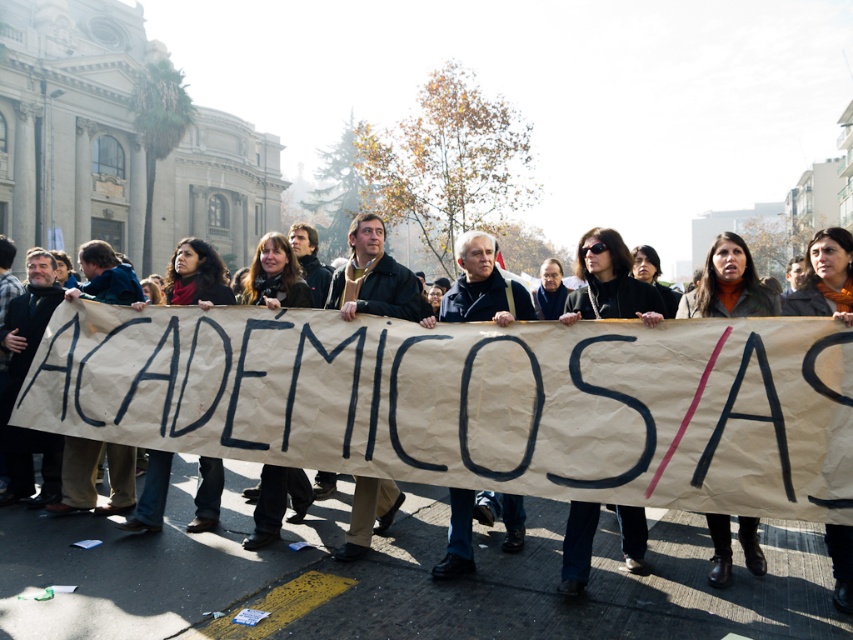
Does dark brown leather jacket at center have a greater width compared to matte black sunglasses at center?

Yes.

Does dark brown leather jacket at center appear on the right side of matte black sunglasses at center?

No, dark brown leather jacket at center is not to the right of matte black sunglasses at center.

What do you see at coordinates (479, 406) in the screenshot? I see `dark brown leather jacket at center` at bounding box center [479, 406].

The width and height of the screenshot is (853, 640). I want to click on dark brown leather jacket at center, so [479, 406].

Where is `dark brown leather jacket at center`? The height and width of the screenshot is (640, 853). dark brown leather jacket at center is located at coordinates (479, 406).

Between dark brown leather jacket at center and dark gray sweater at center, which one is positioned higher?

Positioned higher is dark gray sweater at center.

Describe the element at coordinates (479, 406) in the screenshot. I see `dark brown leather jacket at center` at that location.

Image resolution: width=853 pixels, height=640 pixels. I want to click on dark brown leather jacket at center, so click(479, 406).

Consider the image. Does matte black sunglasses at center appear over dark gray sweater at center?

Indeed, matte black sunglasses at center is positioned over dark gray sweater at center.

How distant is matte black sunglasses at center from dark gray sweater at center?

They are 24.78 inches apart.

What do you see at coordinates (608, 282) in the screenshot? I see `matte black sunglasses at center` at bounding box center [608, 282].

You are a GUI agent. You are given a task and a screenshot of the screen. Output one action in this format:
    pyautogui.click(x=<x>, y=<y>)
    Task: Click on the matte black sunglasses at center
    
    Given the screenshot: What is the action you would take?
    pyautogui.click(x=608, y=282)